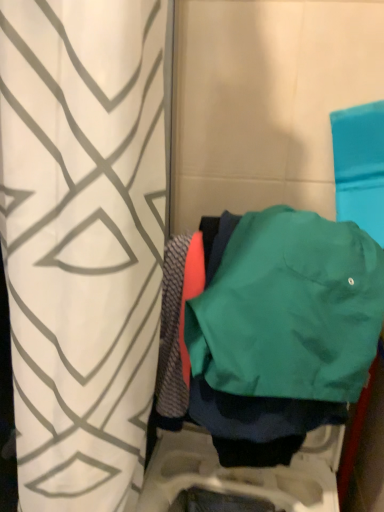
Question: Is green fabric jacket at center directly adjacent to white geometric-patterned curtain at center?

Choices:
 (A) yes
 (B) no

Answer: (B)

Question: Is green fabric jacket at center thinner than white geometric-patterned curtain at center?

Choices:
 (A) yes
 (B) no

Answer: (A)

Question: Is green fabric jacket at center at the right side of white geometric-patterned curtain at center?

Choices:
 (A) yes
 (B) no

Answer: (A)

Question: Is green fabric jacket at center taller than white geometric-patterned curtain at center?

Choices:
 (A) no
 (B) yes

Answer: (A)

Question: Could you tell me if green fabric jacket at center is turned towards white geometric-patterned curtain at center?

Choices:
 (A) yes
 (B) no

Answer: (B)

Question: Is white geometric-patterned curtain at center located within green fabric jacket at center?

Choices:
 (A) yes
 (B) no

Answer: (B)

Question: Is white geometric-patterned curtain at center further to the viewer compared to green fabric jacket at center?

Choices:
 (A) yes
 (B) no

Answer: (B)

Question: From the image's perspective, is white geometric-patterned curtain at center located above green fabric jacket at center?

Choices:
 (A) yes
 (B) no

Answer: (B)

Question: Would you say white geometric-patterned curtain at center is a long distance from green fabric jacket at center?

Choices:
 (A) no
 (B) yes

Answer: (A)

Question: Does white geometric-patterned curtain at center turn towards green fabric jacket at center?

Choices:
 (A) yes
 (B) no

Answer: (A)

Question: Does white geometric-patterned curtain at center have a lesser height compared to green fabric jacket at center?

Choices:
 (A) no
 (B) yes

Answer: (A)

Question: From a real-world perspective, is white geometric-patterned curtain at center positioned over green fabric jacket at center based on gravity?

Choices:
 (A) yes
 (B) no

Answer: (B)

Question: Is white geometric-patterned curtain at center to the left or to the right of green fabric jacket at center in the image?

Choices:
 (A) left
 (B) right

Answer: (A)